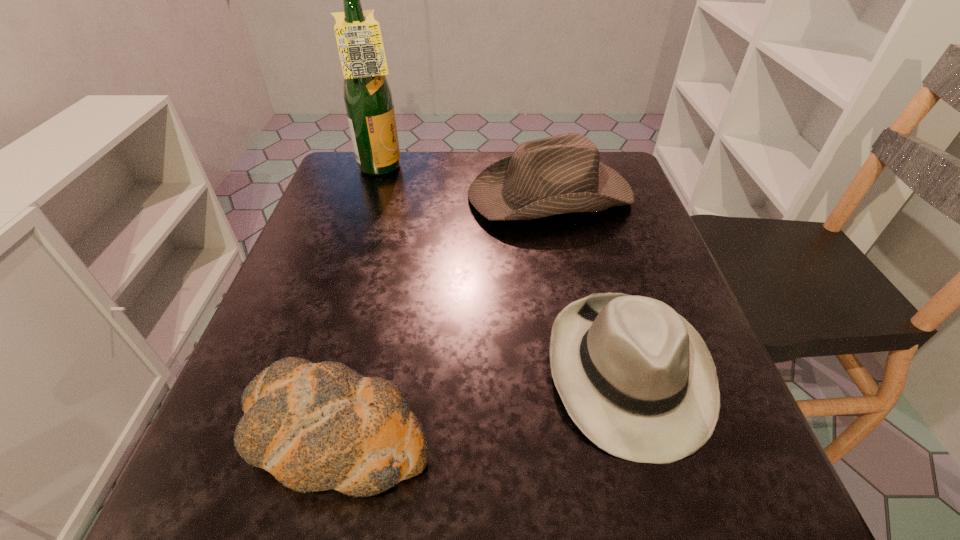
Locate an element on the screen. liquor is located at coordinates (368, 99).

I want to click on the taller fedora, so click(x=561, y=174).

Find the location of a particular element. the second tallest object is located at coordinates (561, 174).

Find the location of a particular element. The height and width of the screenshot is (540, 960). the shorter fedora is located at coordinates (637, 379).

The height and width of the screenshot is (540, 960). In order to click on bread in this screenshot , I will do `click(314, 426)`.

The height and width of the screenshot is (540, 960). Find the location of `free spot located on the front-facing side of the liquor`. free spot located on the front-facing side of the liquor is located at coordinates (444, 170).

The image size is (960, 540). I want to click on free space located 0.080m on the front of the taller fedora, so click(x=562, y=258).

Identify the location of free point located on the front-facing side of the nearer fedora. (666, 504).

Image resolution: width=960 pixels, height=540 pixels. I want to click on vacant area situated 0.070m on the back of the bread, so click(357, 343).

Where is `liquor that is at the far edge`? liquor that is at the far edge is located at coordinates [368, 99].